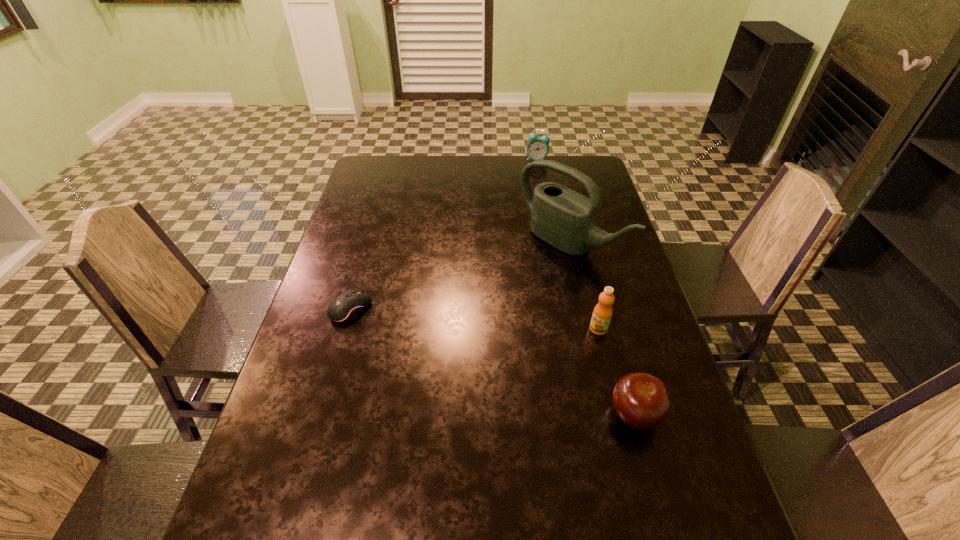
The image size is (960, 540). In order to click on the leftmost object in this screenshot , I will do `click(347, 306)`.

I want to click on computer mouse, so click(x=347, y=306).

Locate an element on the screen. the nearest object is located at coordinates (642, 401).

This screenshot has width=960, height=540. What are the coordinates of `alarm clock` in the screenshot? It's located at (538, 148).

In order to click on watering can in this screenshot , I will do `click(565, 219)`.

In order to click on the fourth nearest object in this screenshot , I will do `click(565, 219)`.

Where is `orange juice`? orange juice is located at coordinates (602, 313).

You are a GUI agent. You are given a task and a screenshot of the screen. Output one action in this format:
    pyautogui.click(x=<x>, y=<y>)
    Task: Click on the vacant space situated 0.090m on the back of the leftmost object
    
    Given the screenshot: What is the action you would take?
    pyautogui.click(x=362, y=271)

Image resolution: width=960 pixels, height=540 pixels. Find the location of `vacant space located on the left of the nearest object`. vacant space located on the left of the nearest object is located at coordinates (553, 415).

Locate an element on the screen. vacant area situated 0.200m on the face of the farthest object is located at coordinates (530, 192).